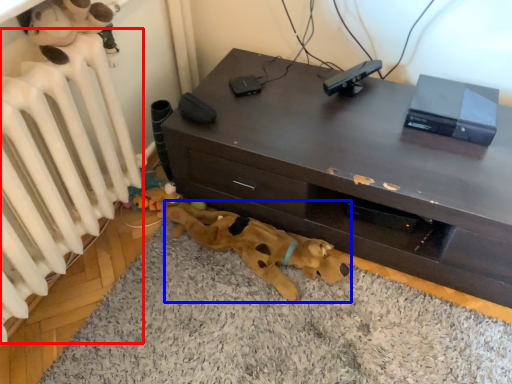
Question: Which point is further to the camera, radiator (highlighted by a red box) or toy (highlighted by a blue box)?

Choices:
 (A) radiator
 (B) toy

Answer: (B)